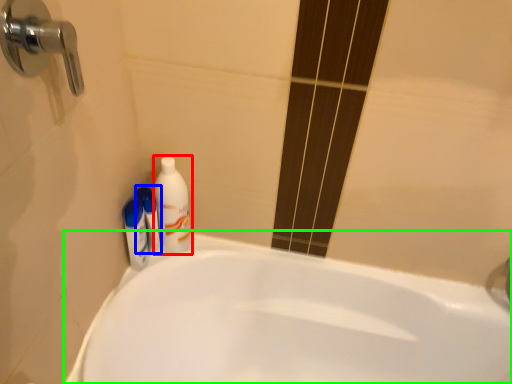
Question: Which object is the farthest from cleaning product (highlighted by a red box)? Choose among these: mouthwash (highlighted by a blue box) or bathtub (highlighted by a green box).

Choices:
 (A) mouthwash
 (B) bathtub

Answer: (B)